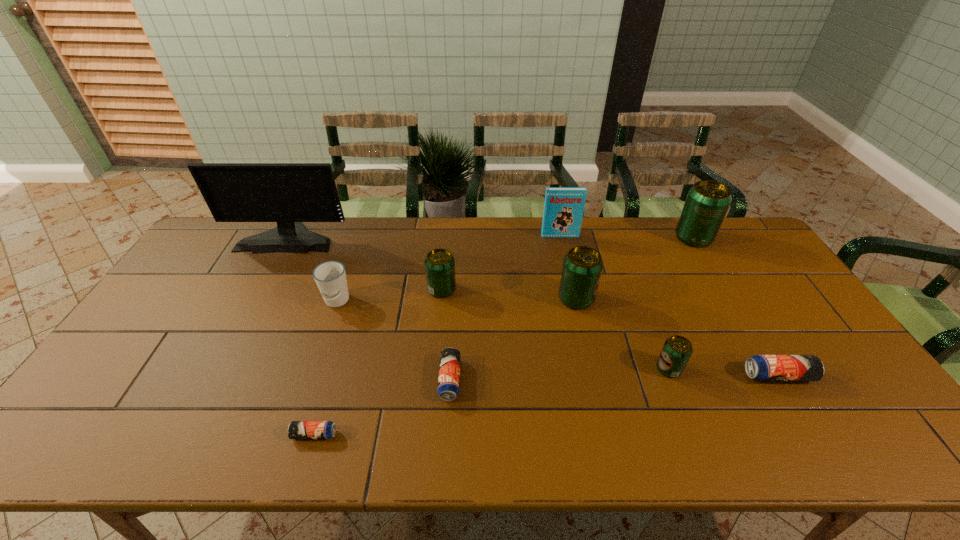
Where is `empty space between the farthest beer can and the book`? The width and height of the screenshot is (960, 540). empty space between the farthest beer can and the book is located at coordinates (627, 237).

This screenshot has height=540, width=960. What are the coordinates of `vacant space that's between the nearest blue beer can and the rightmost blue beer can` in the screenshot? It's located at (546, 405).

Find the location of a particular element. The width and height of the screenshot is (960, 540). free space between the second biggest blue beer can and the cup is located at coordinates (394, 341).

In order to click on vacant point located between the third beer can from right to left and the third tallest beer can in this screenshot , I will do `click(555, 329)`.

You are a GUI agent. You are given a task and a screenshot of the screen. Output one action in this format:
    pyautogui.click(x=<x>, y=<y>)
    Task: Click on the empty space that is in between the leftmost green beer can and the blue book
    
    Given the screenshot: What is the action you would take?
    pyautogui.click(x=501, y=263)

What are the coordinates of `free spot between the fifth tallest beer can and the blue book` in the screenshot? It's located at pos(669,306).

Where is `blank region between the nearest green beer can and the blue book`? Image resolution: width=960 pixels, height=540 pixels. blank region between the nearest green beer can and the blue book is located at coordinates (614, 302).

Locate an element on the screen. The image size is (960, 540). free space between the monitor and the cup is located at coordinates (312, 269).

Choose which object is the eighth nearest neighbor to the tallest beer can. Please provide its 2D coordinates. Your answer should be formatted as a tuple, i.e. [(x, y)], where the tuple contains the x and y coordinates of a point satisfying the conditions above.

[(287, 193)]

Identify which object is the seventh nearest to the eighth tallest object. Please provide its 2D coordinates. Your answer should be formatted as a tuple, i.e. [(x, y)], where the tuple contains the x and y coordinates of a point satisfying the conditions above.

[(296, 429)]